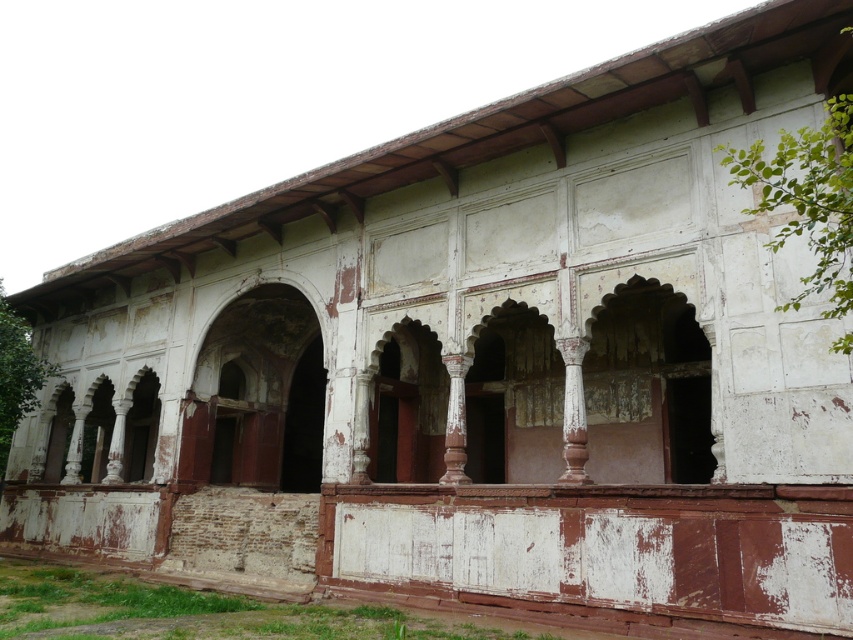
You are standing in front of the historical building and want to walk through the archway. Which archway should you approach first, the rusty metal archway at center or the rustic stone archway at center?

You should approach the rusty metal archway at center first because it is closer to you than the rustic stone archway at center.